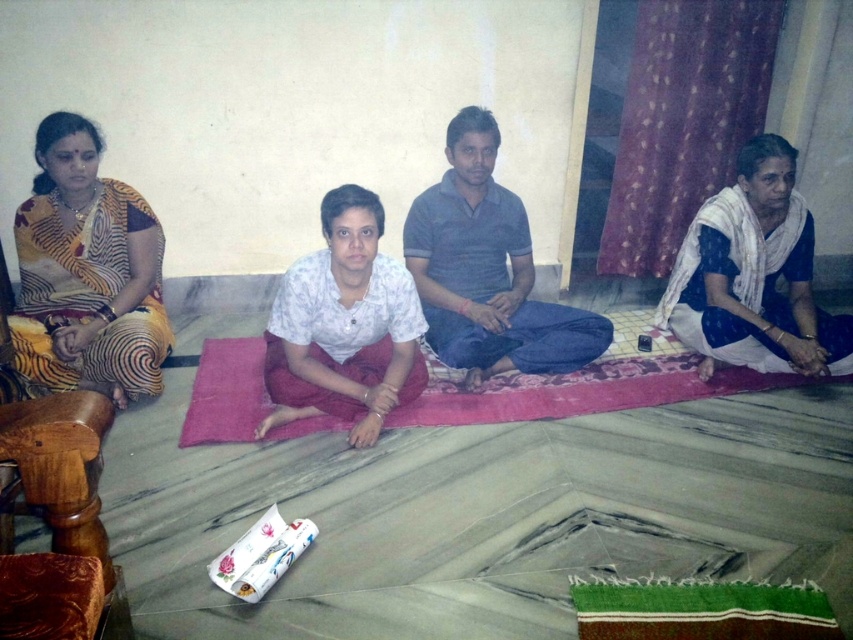
You are organizing a clothing donation drive and need to determine which item is larger between the white cotton saree at right and the white cotton shirt at center. Which one should you choose if you need to donate the larger item?

The white cotton saree at right is bigger than the white cotton shirt at center, so you should donate the white cotton saree at right.

You are organizing a cultural event and need to place a decorative item on the floor. The white cotton saree at right is currently at point 0.431, 0.885. Can you confirm if there is enough space to place a 0.3 meters wide decorative item next to it without overlapping?

The white cotton saree at right is located at point (753,275). Since the question does not provide information about the saree size or the available space around it, I cannot determine if there is enough space to place the decorative item without overlapping.